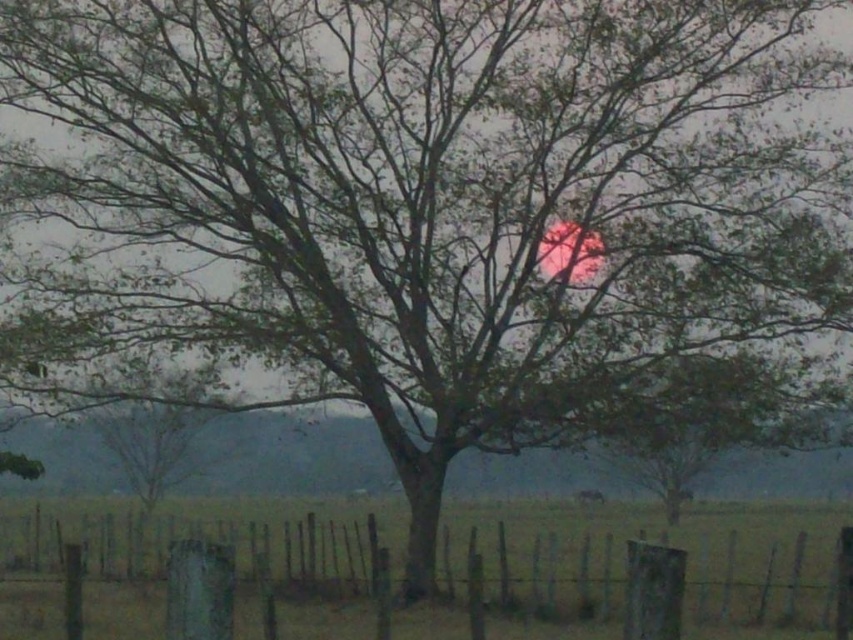
You are a painter setting up your easel in the field. You want to capture both the wooden post fence at lower center and the green matte tree at center in your painting. Which object will appear taller in your painting?

The green matte tree at center will appear taller in the painting since it is taller than the wooden post fence at lower center.

You are a painter setting up your easel in the middle of the field. You want to capture the scene so that both the wooden post fence at lower center and the green matte tree at center are clearly visible in your painting. Which object should you place closer to the edge of your canvas to ensure both fit without overcrowding?

The wooden post fence at lower center might be wider than the green matte tree at center, so you should place the fence closer to the edge to leave enough space for the tree in the center.